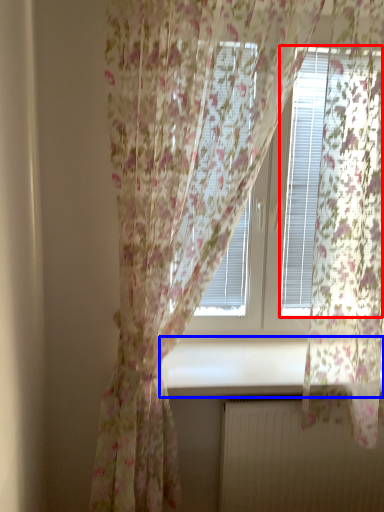
Question: Which point is closer to the camera, blind (highlighted by a red box) or window sill (highlighted by a blue box)?

Choices:
 (A) blind
 (B) window sill

Answer: (A)